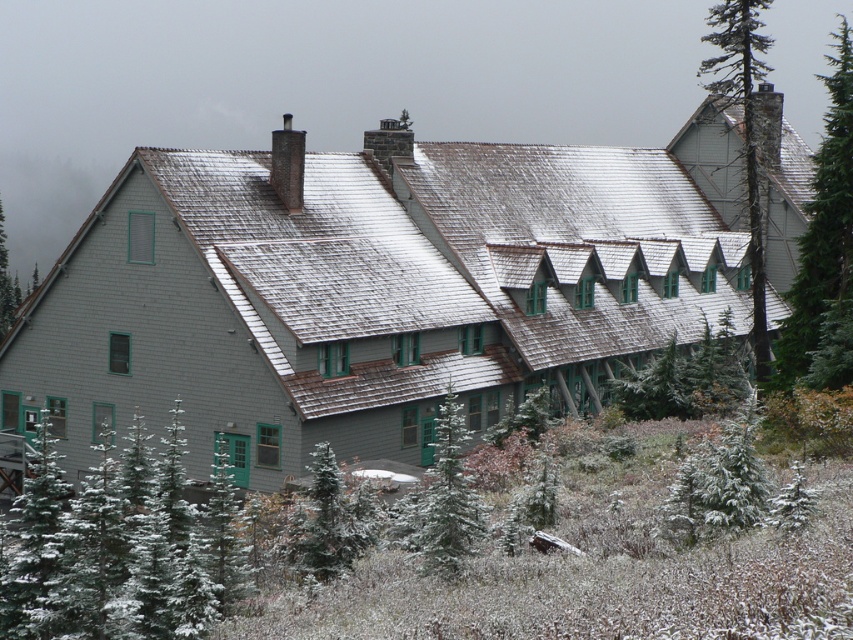
You are a delivery person trying to navigate between the two green textured pine trees. The path between them is narrow. If your delivery cart is 5 meters wide, will you be able to pass through the space between the green textured pine tree at lower left and the green textured pine tree at center?

The green textured pine tree at lower left and green textured pine tree at center are 4.98 meters apart from each other. Since the distance between them is slightly less than the cart width of 5 meters, the cart will not fit through the space between the two trees.

You are standing in front of the two trees in the snowy landscape. Which tree is closer to you, the green textured pine tree at lower left or the smooth bark tree at upper right?

The green textured pine tree at lower left is closer to you because it is positioned at the lower left, which is typically closer in such scenes, whereas the smooth bark tree at upper right is placed higher up, indicating it might be farther away. However, according to the description, the green textured pine tree at lower left is smaller in size compared to the smooth bark tree at upper right. Since size can indicate distance, a smaller object might be farther away. But in this case, the spatial placement,